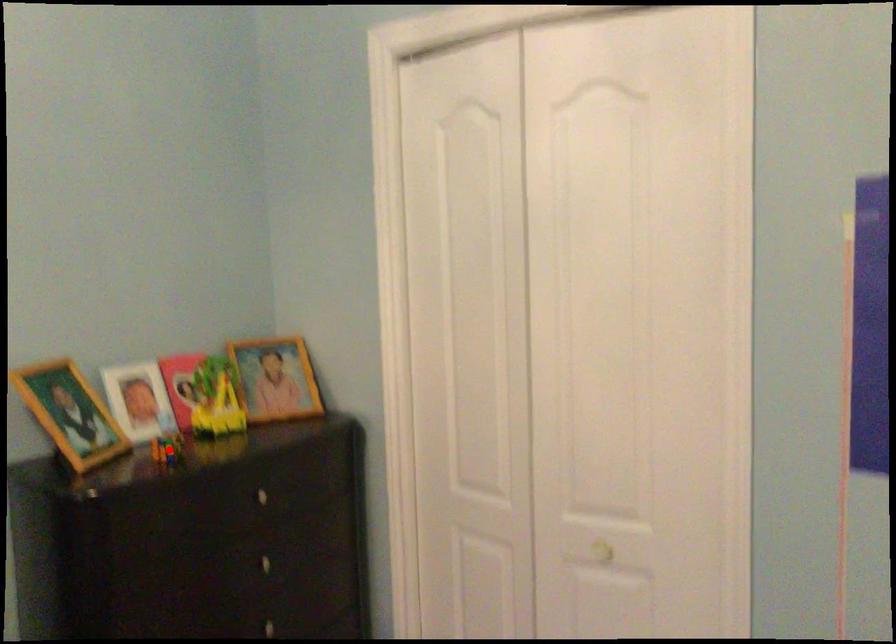
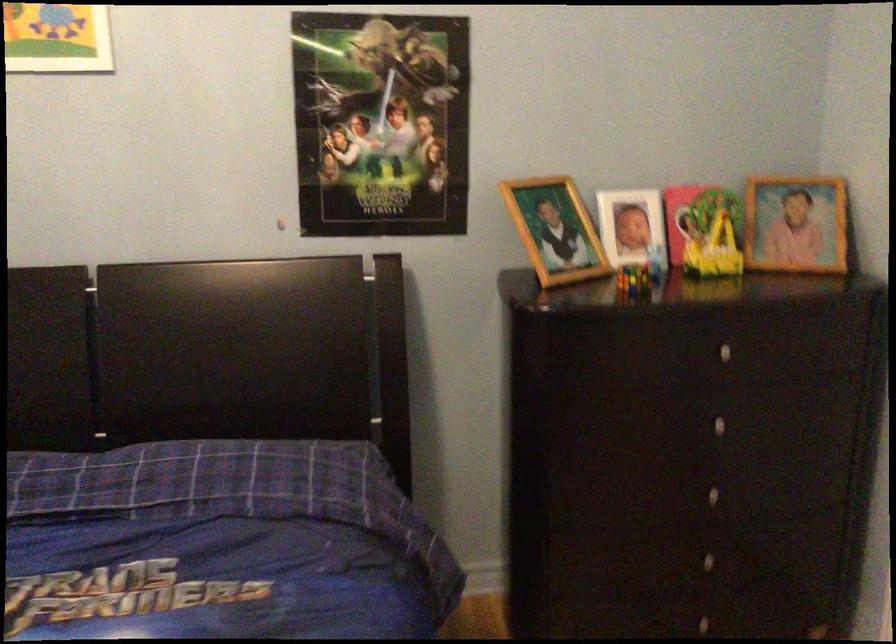
Locate, in the second image, the point that corresponds to the highlighted location in the first image.

(634, 279)